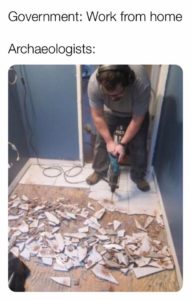
I want to click on tile floor, so pyautogui.click(x=33, y=174), pyautogui.click(x=64, y=178).